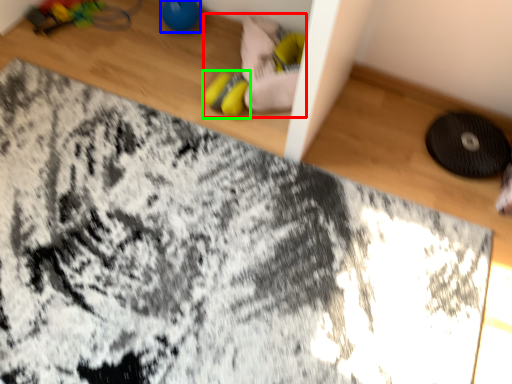
Question: Which is farther away from toy (highlighted by a red box)? toy (highlighted by a blue box) or footwear (highlighted by a green box)?

Choices:
 (A) toy
 (B) footwear

Answer: (A)